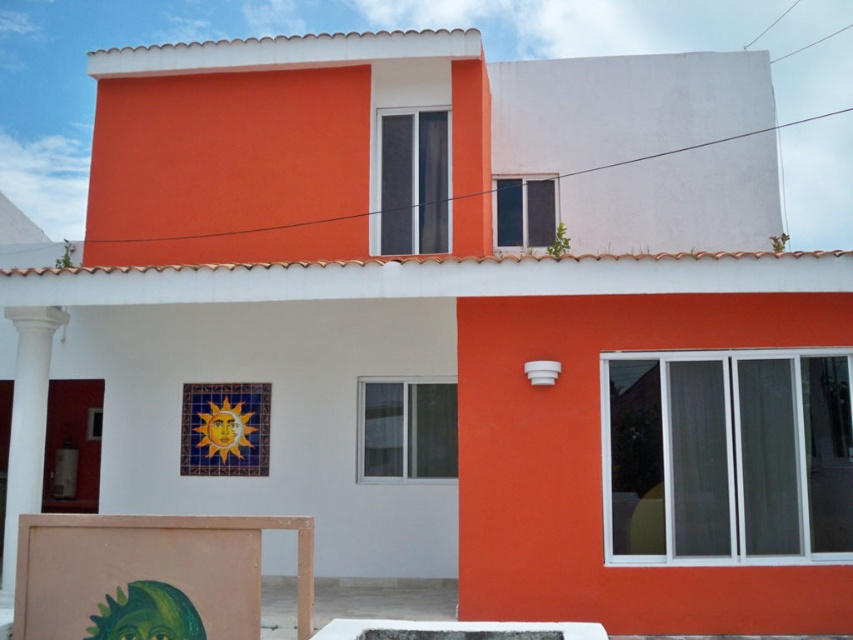
Who is positioned more to the left, matte pink easel at lower left or white smooth column at left?

white smooth column at left is more to the left.

Is point (144, 520) farther from camera compared to point (56, 310)?

No.

Locate an element on the screen. The image size is (853, 640). matte pink easel at lower left is located at coordinates (149, 576).